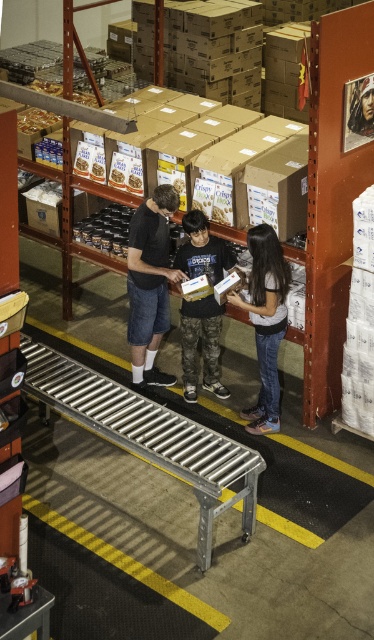
You are a warehouse worker who needs to retrieve an item from the industrial shelving units. You see both the denim shorts at center and the camouflage pants at center. Which item is on top of the other?

The denim shorts at center is positioned over camouflage pants at center, so the denim shorts at center is on top of the camouflage pants at center.

You are a warehouse worker tasked with retrieving items. You see the denim shorts at center and the smooth leather jacket at upper center. Which item is located above the other?

The smooth leather jacket at upper center is above the denim shorts at center because it is positioned over it.